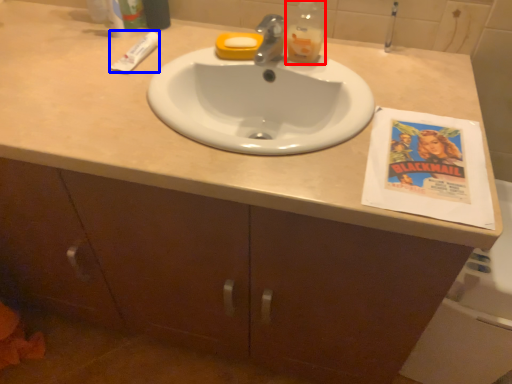
Question: Which object appears farthest to the camera in this image, bottle (highlighted by a red box) or toothpaste (highlighted by a blue box)?

Choices:
 (A) bottle
 (B) toothpaste

Answer: (B)